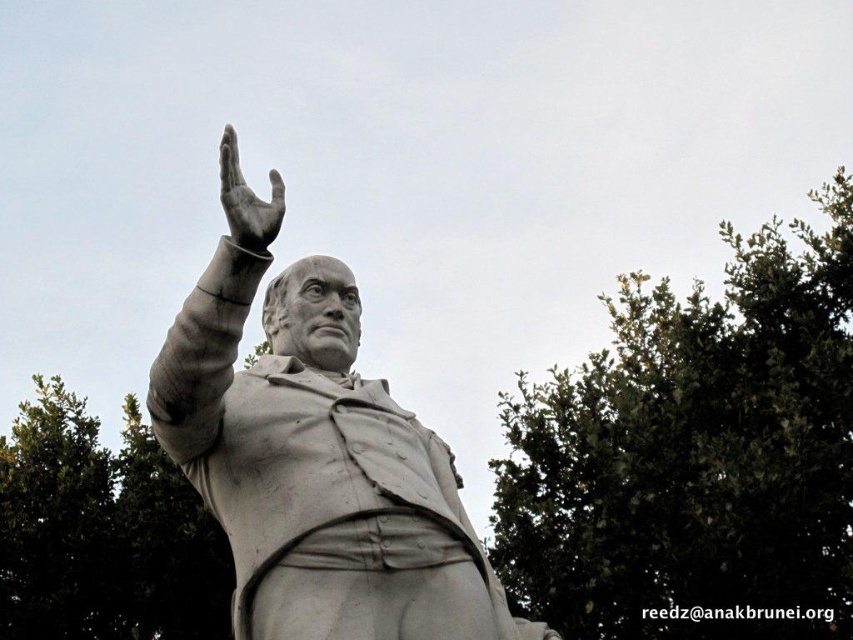
Measure the distance between white marble statue at center and polished bronze hand at upper center.

white marble statue at center and polished bronze hand at upper center are 3.77 meters apart from each other.

Based on the photo, is white marble statue at center shorter than polished bronze hand at upper center?

In fact, white marble statue at center may be taller than polished bronze hand at upper center.

Where is `white marble statue at center`? Image resolution: width=853 pixels, height=640 pixels. white marble statue at center is located at coordinates (318, 467).